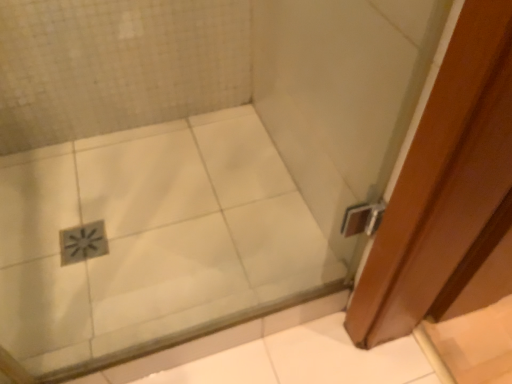
Identify the location of white glossy tile at center. (152, 242).

The image size is (512, 384). Describe the element at coordinates (152, 242) in the screenshot. I see `white glossy tile at center` at that location.

Where is `white glossy tile at center`? The width and height of the screenshot is (512, 384). white glossy tile at center is located at coordinates (152, 242).